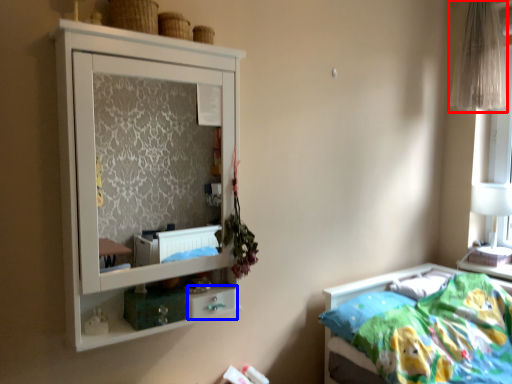
Question: Which point is closer to the camera, curtain (highlighted by a red box) or drawer (highlighted by a blue box)?

Choices:
 (A) curtain
 (B) drawer

Answer: (B)